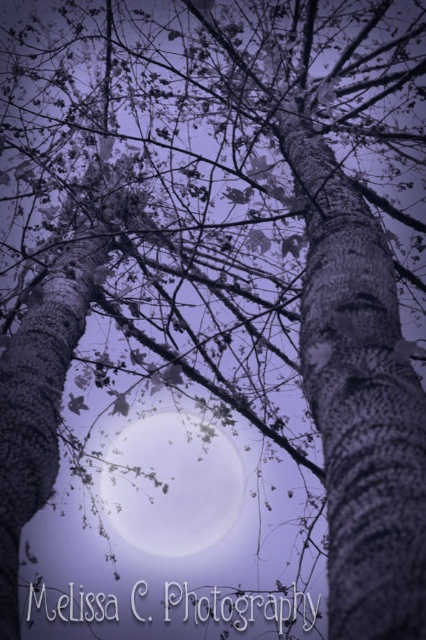
Does smooth bark tree trunk at center have a larger size compared to translucent glass moon at center?

Yes.

Can you confirm if smooth bark tree trunk at center is positioned below translucent glass moon at center?

No.

This screenshot has width=426, height=640. What are the coordinates of `smooth bark tree trunk at center` in the screenshot? It's located at tap(359, 400).

Where is `smooth bark tree trunk at center`? Image resolution: width=426 pixels, height=640 pixels. smooth bark tree trunk at center is located at coordinates (359, 400).